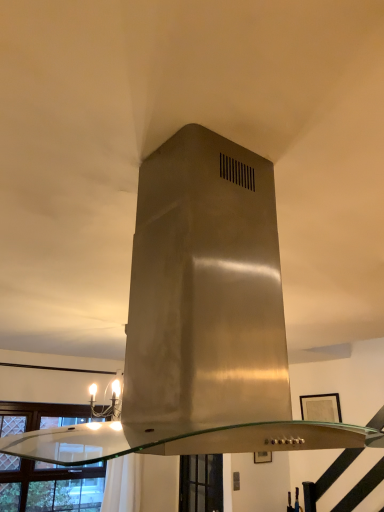
Question: From the image's perspective, is clear glass window at lower center, positioned as the first window in right-to-left order, above or below clear glass window at lower left, placed as the 2th window when sorted from right to left?

Choices:
 (A) above
 (B) below

Answer: (B)

Question: From a real-world perspective, is clear glass window at lower center, positioned as the first window in right-to-left order, physically located above or below clear glass window at lower left, placed as the 2th window when sorted from right to left?

Choices:
 (A) below
 (B) above

Answer: (A)

Question: From their relative heights in the image, would you say clear glass window at lower center, which is counted as the 2th window, starting from the left, is taller or shorter than clear glass window at lower left, placed as the 2th window when sorted from right to left?

Choices:
 (A) tall
 (B) short

Answer: (B)

Question: From the image's perspective, is clear glass window at lower left, placed as the 2th window when sorted from right to left, located above or below clear glass window at lower center, which is counted as the 2th window, starting from the left?

Choices:
 (A) above
 (B) below

Answer: (A)

Question: Is clear glass window at lower left, placed as the 2th window when sorted from right to left, in front of or behind clear glass window at lower center, positioned as the first window in right-to-left order, in the image?

Choices:
 (A) behind
 (B) front

Answer: (B)

Question: Is clear glass window at lower left, placed as the 2th window when sorted from right to left, inside or outside of clear glass window at lower center, positioned as the first window in right-to-left order?

Choices:
 (A) outside
 (B) inside

Answer: (A)

Question: Looking at their shapes, would you say clear glass window at lower left, placed as the 2th window when sorted from right to left, is wider or thinner than clear glass window at lower center, which is counted as the 2th window, starting from the left?

Choices:
 (A) wide
 (B) thin

Answer: (A)